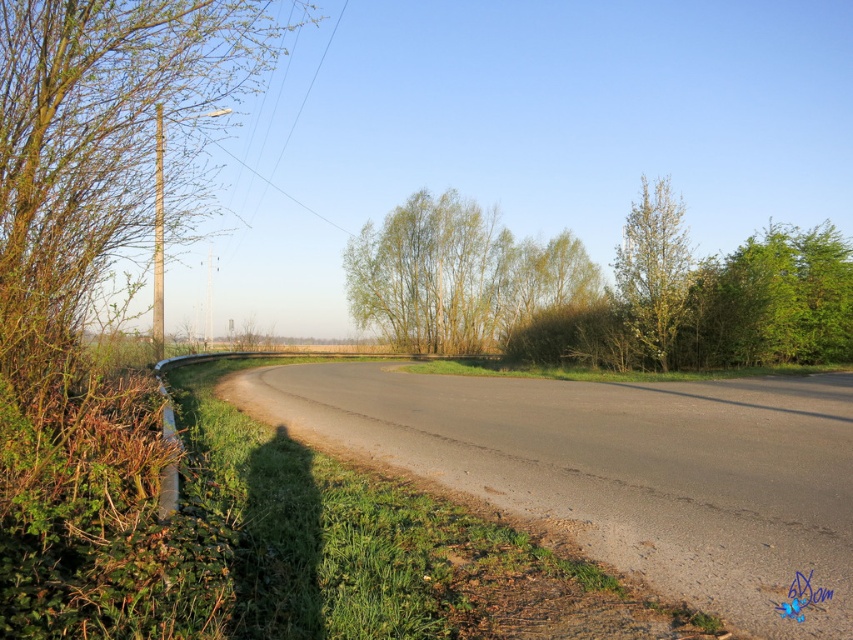
Does point (45, 237) come closer to viewer compared to point (657, 285)?

Yes, it is.

Locate an element on the screen. This screenshot has width=853, height=640. green leafy tree at left is located at coordinates (102, 148).

I want to click on green leafy tree at left, so click(x=102, y=148).

Does green leafy trees at center come behind green leafy tree at upper right?

Yes.

Does point (434, 262) come farther from viewer compared to point (653, 275)?

Yes, it is.

The image size is (853, 640). I want to click on green leafy trees at center, so click(457, 275).

From the picture: Who is positioned more to the left, green leafy tree at left or green leafy trees at center?

Positioned to the left is green leafy tree at left.

The height and width of the screenshot is (640, 853). What do you see at coordinates (102, 148) in the screenshot? I see `green leafy tree at left` at bounding box center [102, 148].

The height and width of the screenshot is (640, 853). What do you see at coordinates (102, 148) in the screenshot?
I see `green leafy tree at left` at bounding box center [102, 148].

Where is `green leafy tree at left`? green leafy tree at left is located at coordinates (102, 148).